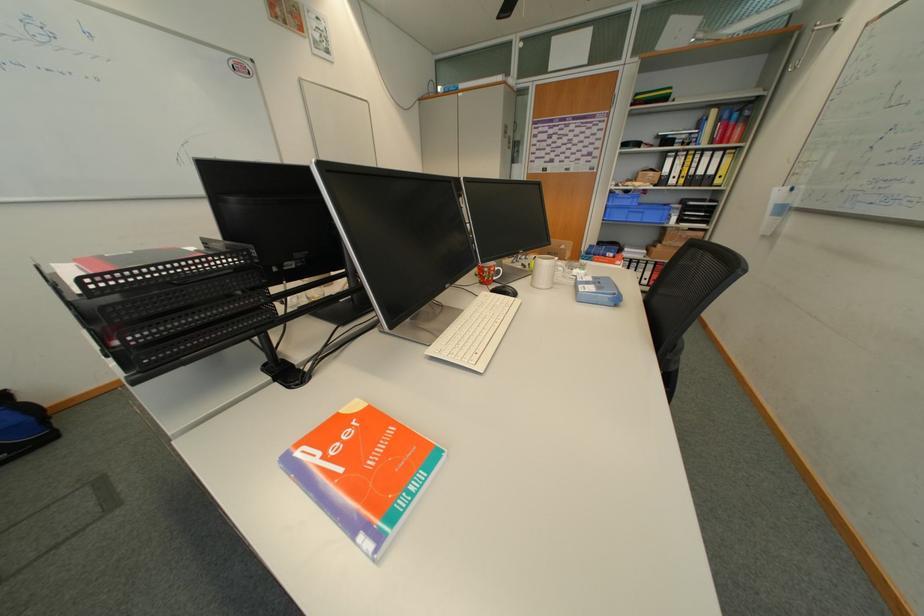
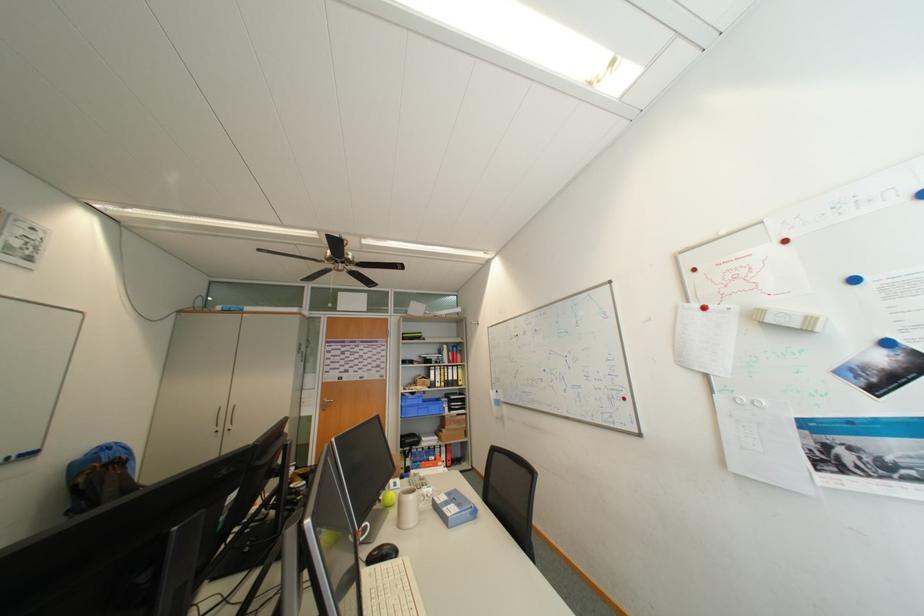
Locate, in the second image, the point that corresponds to pixel 682 183 in the first image.

(447, 386)